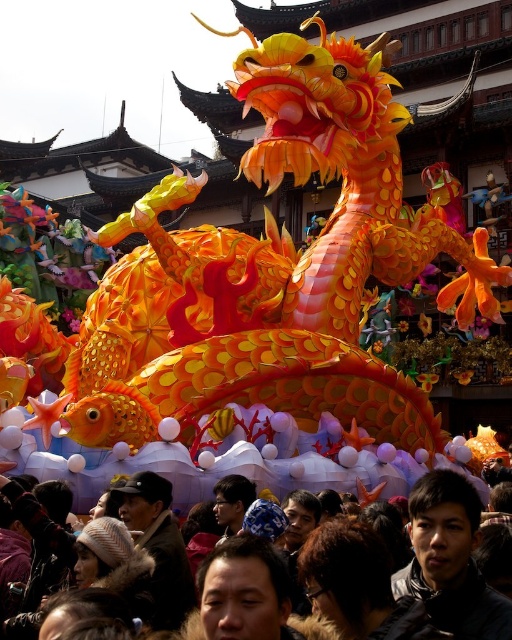
In the scene shown: Which of these two, dark brown fur coat at lower center or matte black jacket at lower right, stands taller?

With more height is matte black jacket at lower right.

Can you confirm if dark brown fur coat at lower center is positioned below matte black jacket at lower right?

No.

Does point (332, 557) come in front of point (426, 490)?

Yes, point (332, 557) is closer to viewer.

Find the location of a particular element. The width and height of the screenshot is (512, 640). dark brown fur coat at lower center is located at coordinates (358, 577).